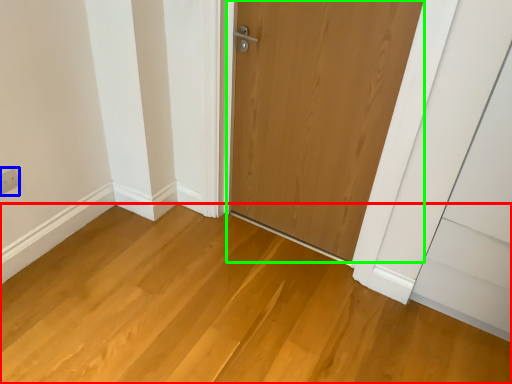
Question: Which object is the closest to the plain (highlighted by a red box)? Choose among these: electric outlet (highlighted by a blue box) or door (highlighted by a green box).

Choices:
 (A) electric outlet
 (B) door

Answer: (B)